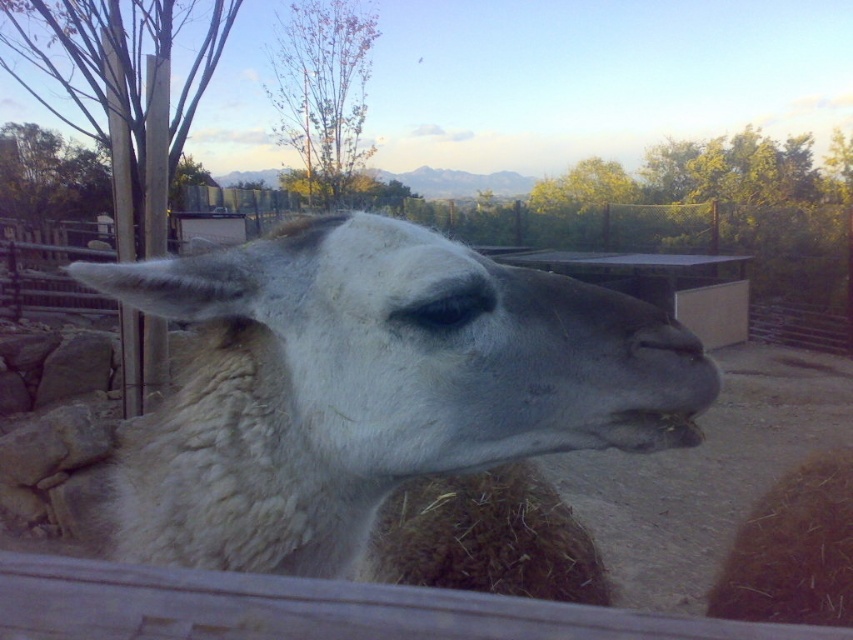
You are standing in front of the llama and want to place a small treat between the two points, point (517, 346) and point (651, 337). Which point is closer to you so you can place the treat there?

Point (517, 346) is closer to you because it is further to the viewer than point (651, 337).

Looking at this image, you are a photographer trying to capture the white woolen alpaca at center and the white woolen nose at center in a single shot. Based on their positions, which one would appear larger in the photo?

The white woolen alpaca at center would appear larger in the photo because it is closer to the viewer than the white woolen nose at center.

You are a photographer trying to capture the white woolen alpaca at center and the white woolen nose at center in a single frame. Based on their widths, which one would appear smaller in the photo?

The white woolen alpaca at center has a lesser width compared to the white woolen nose at center, so it would appear smaller in the photo.